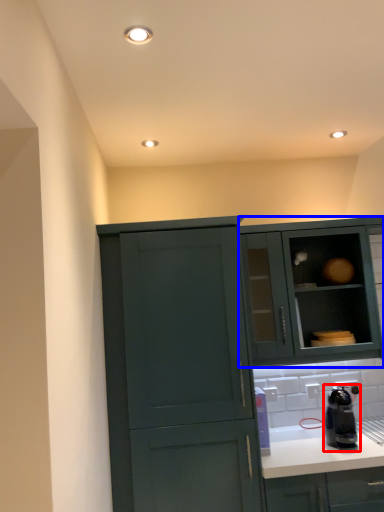
Question: Which object appears closest to the camera in this image, kitchen appliance (highlighted by a red box) or cabinetry (highlighted by a blue box)?

Choices:
 (A) kitchen appliance
 (B) cabinetry

Answer: (A)